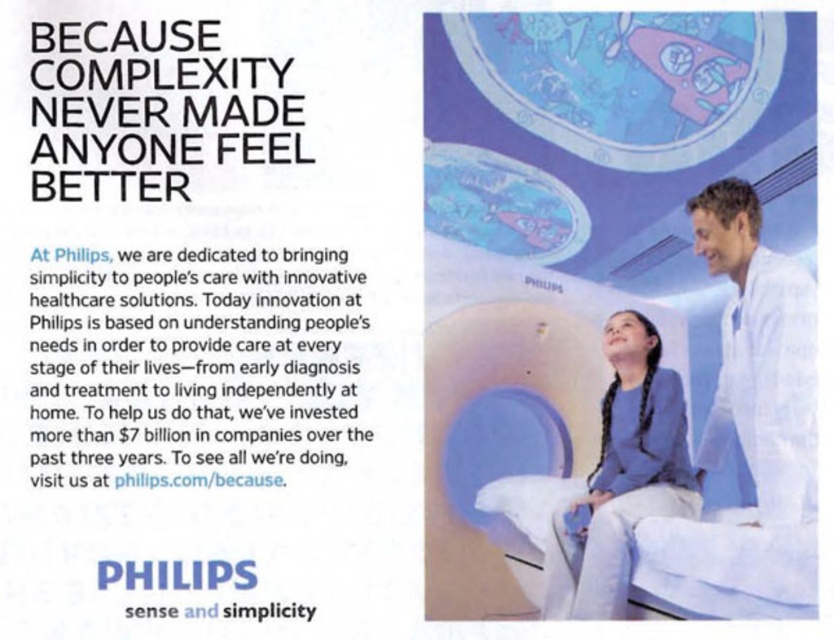
In the Philips advertisement, you see a blue fabric at center and a white fabric hospital bed at lower right. Which object takes up more space in the image?

The white fabric hospital bed at lower right takes up more space in the image than the blue fabric at center because the blue fabric at center has a smaller size compared to the white fabric hospital bed at lower right.

In the Philips advertisement, there are two fabrics displayed. The blue fabric at center and the white fabric hospital bed at lower right. Which fabric is taller?

The blue fabric at center is much taller than the white fabric hospital bed at lower right.